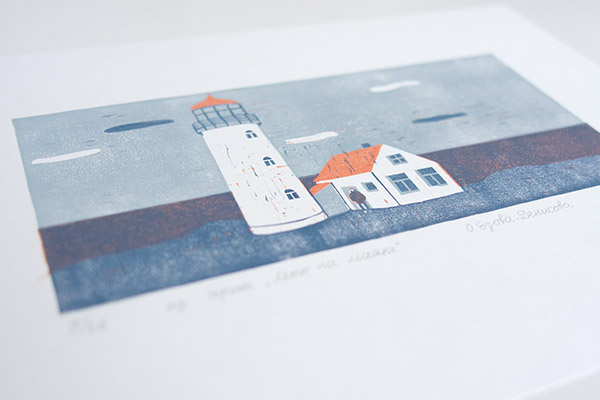
This screenshot has height=400, width=600. Identify the location of windows in the lighthouse. (290, 195), (270, 160), (250, 132).